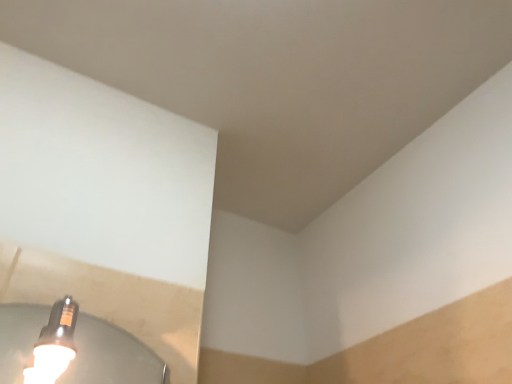
Question: Should I look upward or downward to see white glossy bulb at lower left?

Choices:
 (A) down
 (B) up

Answer: (A)